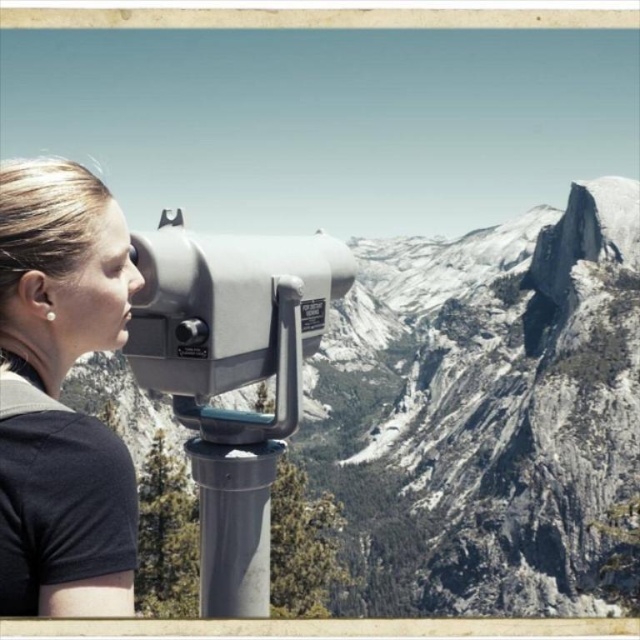
Who is more distant from viewer, (608, 451) or (20, 348)?

The point (608, 451) is more distant.

Between granite rock formation at center and black matte shirt at center, which one appears on the left side from the viewer's perspective?

black matte shirt at center

Between point (560, 228) and point (58, 257), which one is positioned behind?

The point (560, 228) is behind.

Image resolution: width=640 pixels, height=640 pixels. Find the location of `granite rock formation at center`. granite rock formation at center is located at coordinates (148, 390).

Does granite rock formation at center come behind metallic gray telescope at center?

No.

Consider the image. Is granite rock formation at center below metallic gray telescope at center?

No, granite rock formation at center is not below metallic gray telescope at center.

At what (x,y) coordinates should I click in order to perform the action: click on granite rock formation at center. Please return your answer as a coordinate pair (x, y). The image size is (640, 640). Looking at the image, I should click on (148, 390).

Is black matte shirt at center positioned at the back of metallic gray telescope at center?

No, black matte shirt at center is in front of metallic gray telescope at center.

Is point (61, 196) closer to viewer compared to point (161, 259)?

That is True.

Does point (12, 561) come closer to viewer compared to point (300, 326)?

Yes.

Identify the location of black matte shirt at center. The image size is (640, 640). (65, 516).